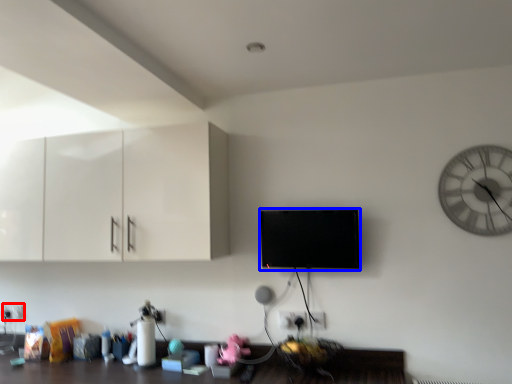
Question: Which object appears closest to the camera in this image, electric outlet (highlighted by a red box) or flat (highlighted by a blue box)?

Choices:
 (A) electric outlet
 (B) flat

Answer: (B)